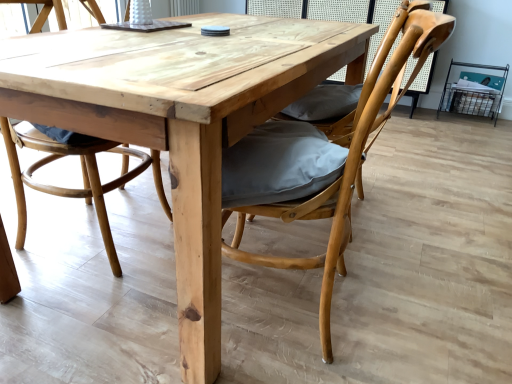
Question: Are natural wood chair at center, which is counted as the second chair, starting from the left, and natural wood table at center located far from each other?

Choices:
 (A) no
 (B) yes

Answer: (A)

Question: From the image's perspective, is natural wood chair at center, which appears as the first chair when viewed from the right, located above natural wood table at center?

Choices:
 (A) yes
 (B) no

Answer: (B)

Question: Is natural wood chair at center, which appears as the first chair when viewed from the right, shorter than natural wood table at center?

Choices:
 (A) no
 (B) yes

Answer: (A)

Question: Is natural wood chair at center, which is counted as the second chair, starting from the left, positioned before natural wood table at center?

Choices:
 (A) no
 (B) yes

Answer: (B)

Question: Is natural wood chair at center, which appears as the first chair when viewed from the right, wider than natural wood table at center?

Choices:
 (A) yes
 (B) no

Answer: (B)

Question: From the image's perspective, is natural wood chair at center, which is counted as the second chair, starting from the left, positioned above or below natural wood chair at center, the 2th chair viewed from the right?

Choices:
 (A) below
 (B) above

Answer: (A)

Question: From a real-world perspective, is natural wood chair at center, which appears as the first chair when viewed from the right, physically located above or below natural wood chair at center, the first chair when ordered from left to right?

Choices:
 (A) below
 (B) above

Answer: (B)

Question: Considering the positions of natural wood chair at center, which appears as the first chair when viewed from the right, and natural wood chair at center, the 2th chair viewed from the right, in the image, is natural wood chair at center, which appears as the first chair when viewed from the right, taller or shorter than natural wood chair at center, the 2th chair viewed from the right,?

Choices:
 (A) tall
 (B) short

Answer: (B)

Question: Is natural wood chair at center, which appears as the first chair when viewed from the right, wider or thinner than natural wood chair at center, the 2th chair viewed from the right?

Choices:
 (A) wide
 (B) thin

Answer: (A)

Question: From the image's perspective, relative to natural wood table at center, is natural wood chair at center, the first chair when ordered from left to right, above or below?

Choices:
 (A) below
 (B) above

Answer: (B)

Question: Is natural wood chair at center, the first chair when ordered from left to right, to the left or to the right of natural wood table at center in the image?

Choices:
 (A) right
 (B) left

Answer: (B)

Question: Is natural wood chair at center, the first chair when ordered from left to right, spatially inside natural wood table at center, or outside of it?

Choices:
 (A) inside
 (B) outside

Answer: (A)

Question: Looking at their shapes, would you say natural wood chair at center, the first chair when ordered from left to right, is wider or thinner than natural wood table at center?

Choices:
 (A) wide
 (B) thin

Answer: (B)

Question: In terms of width, does natural wood table at center look wider or thinner when compared to natural wood chair at center, the 2th chair viewed from the right?

Choices:
 (A) wide
 (B) thin

Answer: (A)

Question: From the image's perspective, is natural wood table at center located above or below natural wood chair at center, the first chair when ordered from left to right?

Choices:
 (A) above
 (B) below

Answer: (B)